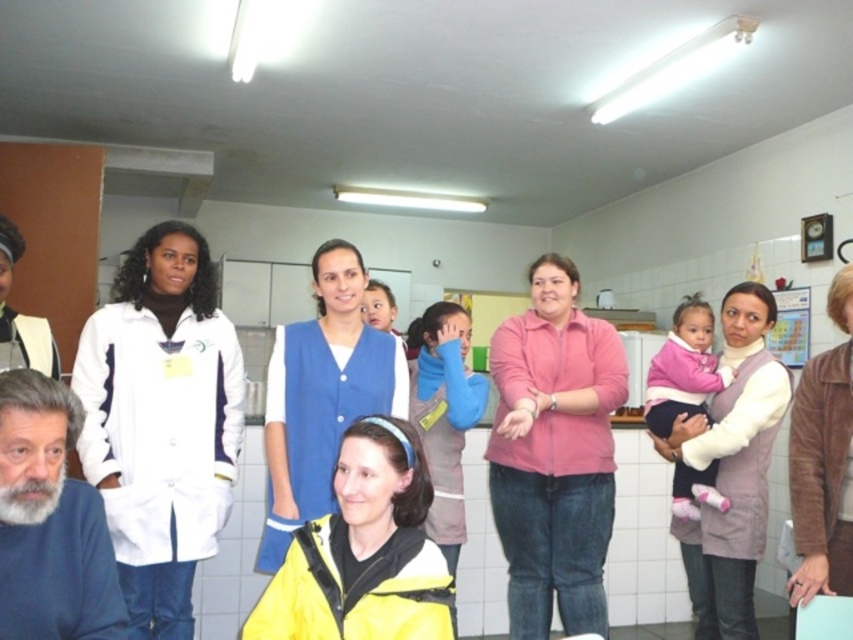
Can you confirm if pink matte shirt at center is shorter than pink fleece jacket at center?

In fact, pink matte shirt at center may be taller than pink fleece jacket at center.

Does pink matte shirt at center appear on the left side of pink fleece jacket at center?

Yes, pink matte shirt at center is to the left of pink fleece jacket at center.

Which is behind, point (515, 561) or point (669, 340)?

The point (669, 340) is more distant.

I want to click on pink matte shirt at center, so click(554, 452).

Can you confirm if white matte lab coat at left is taller than light brown textured vest at center?

No.

Is point (196, 497) closer to camera compared to point (728, 394)?

Yes, it is.

Find the location of a particular element. white matte lab coat at left is located at coordinates (161, 420).

Can you confirm if pink matte shirt at center is positioned above blue fabric vest at center?

Incorrect, pink matte shirt at center is not positioned above blue fabric vest at center.

Who is higher up, pink matte shirt at center or blue fabric vest at center?

Positioned higher is blue fabric vest at center.

Is point (547, 440) closer to viewer compared to point (375, 348)?

That is False.

Locate an element on the screen. This screenshot has width=853, height=640. pink matte shirt at center is located at coordinates (554, 452).